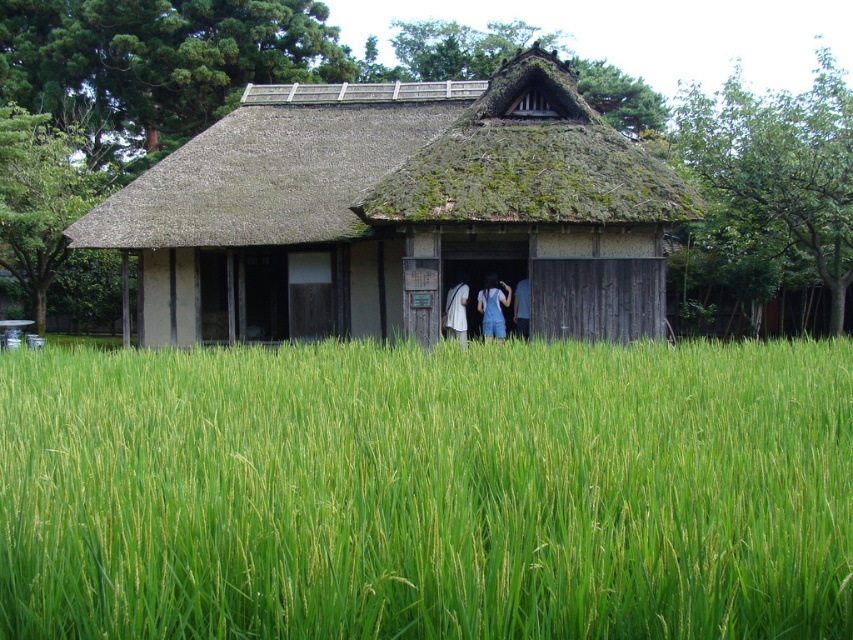
You are standing in front of the traditional Japanese house and want to take a photo of the point at coordinates point (532,93). If your camera has a maximum focus range of 20 meters, will it be able to focus on that point?

The distance of point (532,93) from camera is 18.10 meters, which is within the camera maximum focus range of 20 meters. Therefore, the camera can focus on that point.

You are standing in the middle of the green grassy rice field at center and want to reach the thatched wood hut at center. Which direction should you move to get there?

A: The green grassy rice field at center is in front of the thatched wood hut at center, so you should move backward to reach the thatched wood hut at center.

You are a visitor standing at the entrance of the thatched wood hut at center and denim pants at center. You want to take a photo of both objects in the scene. Which object should you focus on first to ensure both are in frame?

The thatched wood hut at center is taller than denim pants at center, so you should focus on the thatched wood hut at center first to ensure both are in frame.